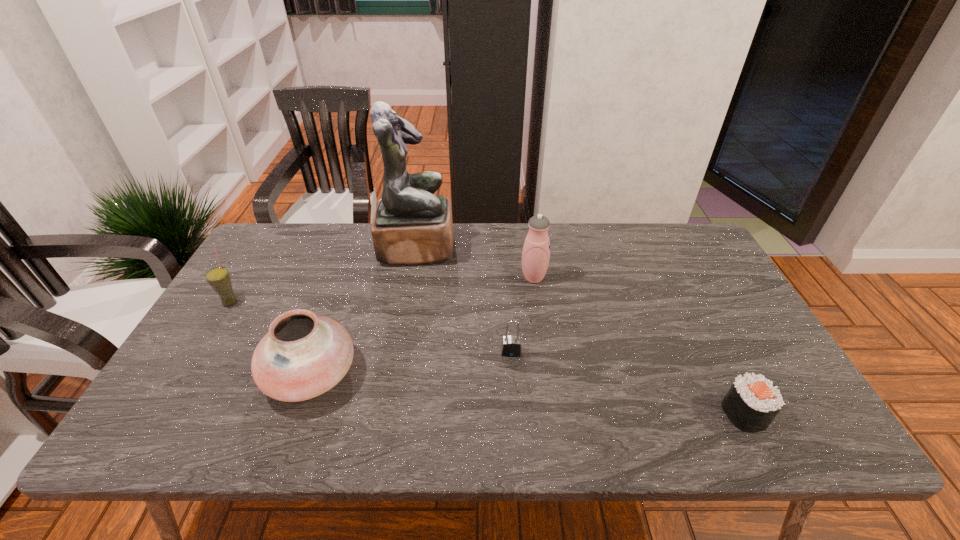
Identify the location of blank area in the image that satisfies the following two spatial constraints: 1. on the shackle of the fourth object from left to right; 2. on the left side of the shortest object. (516, 413).

Locate an element on the screen. This screenshot has height=540, width=960. vacant area in the image that satisfies the following two spatial constraints: 1. on the front side of the pottery; 2. on the right side of the rightmost object is located at coordinates (298, 413).

Where is `free spot that satisfies the following two spatial constraints: 1. on the front side of the shortest object; 2. on the right side of the fifth object from left to right`? This screenshot has width=960, height=540. free spot that satisfies the following two spatial constraints: 1. on the front side of the shortest object; 2. on the right side of the fifth object from left to right is located at coordinates (552, 413).

Find the location of a particular element. free space in the image that satisfies the following two spatial constraints: 1. on the shackle of the rightmost object; 2. on the left side of the padlock is located at coordinates (516, 413).

The height and width of the screenshot is (540, 960). Identify the location of vacant space that satisfies the following two spatial constraints: 1. on the front side of the pottery; 2. on the right side of the straw for drinking. (186, 374).